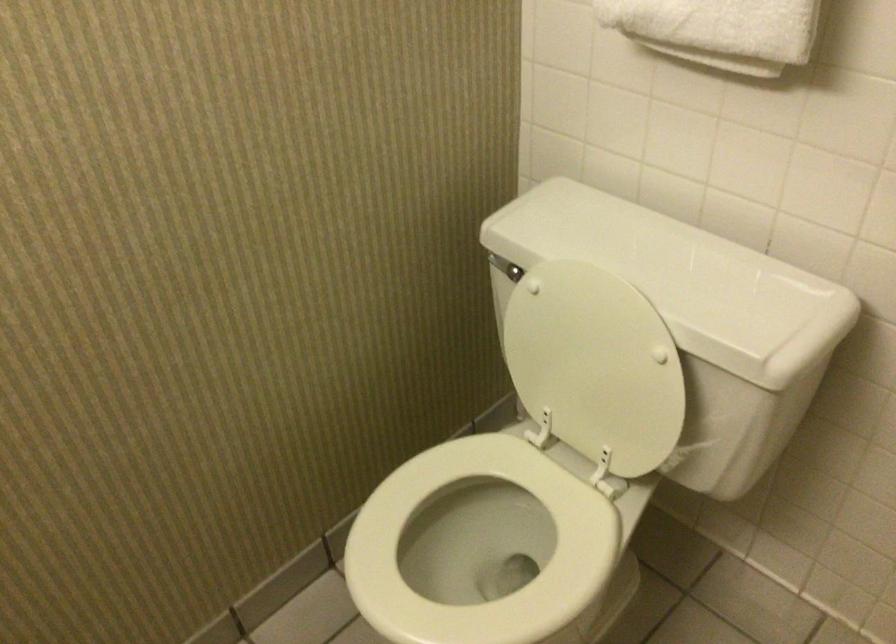
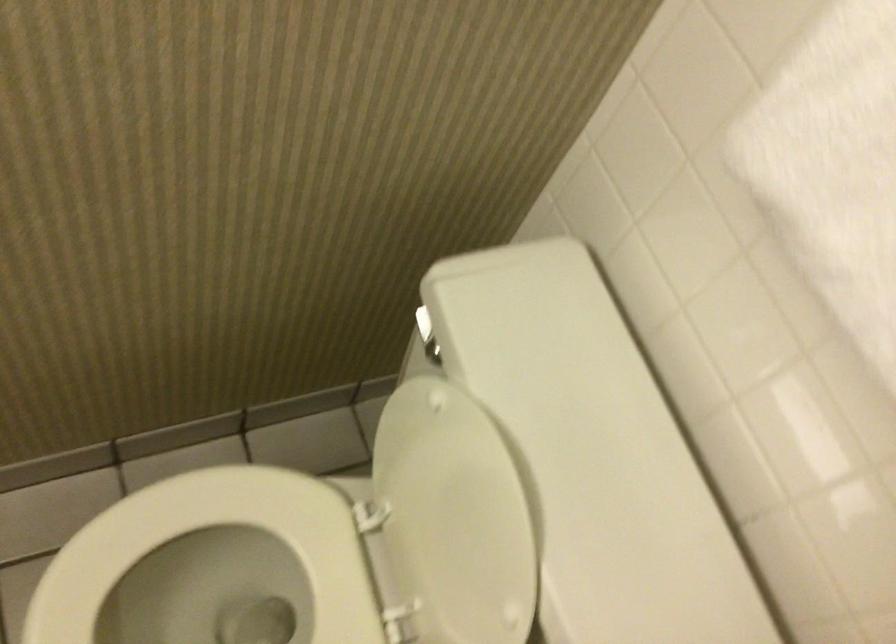
The point at (496, 261) is marked in the first image. Where is the corresponding point in the second image?

(423, 323)